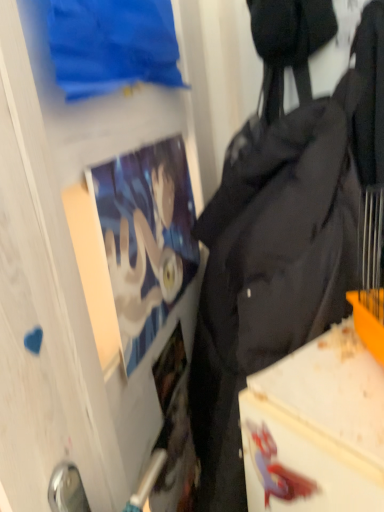
Where is `matte paper poster at upper left`? The image size is (384, 512). matte paper poster at upper left is located at coordinates (146, 238).

Find the location of a particular element. black fabric backpack at right is located at coordinates (281, 226).

Is transparent glass door at upper center bigger than black fabric backpack at right?

No, transparent glass door at upper center is not bigger than black fabric backpack at right.

Considering the points (12, 177) and (235, 346), which point is behind, point (12, 177) or point (235, 346)?

The point (235, 346) is farther from the camera.

How distant is transparent glass door at upper center from black fabric backpack at right?

A distance of 11.99 inches exists between transparent glass door at upper center and black fabric backpack at right.

Considering the relative positions of black fabric backpack at right and matte paper poster at upper left in the image provided, is black fabric backpack at right to the right of matte paper poster at upper left from the viewer's perspective?

Yes.

Between black fabric backpack at right and matte paper poster at upper left, which one has more height?

black fabric backpack at right is taller.

From a real-world perspective, between black fabric backpack at right and matte paper poster at upper left, who is vertically higher?

In real-world perspective, matte paper poster at upper left is above.

How distant is transparent glass door at upper center from matte paper poster at upper left?

They are 8.63 inches apart.

From a real-world perspective, is transparent glass door at upper center located beneath matte paper poster at upper left?

Correct, in the physical world, transparent glass door at upper center is lower than matte paper poster at upper left.

Considering the relative sizes of transparent glass door at upper center and matte paper poster at upper left in the image provided, is transparent glass door at upper center wider than matte paper poster at upper left?

Yes.

From the image's perspective, is transparent glass door at upper center located above or below matte paper poster at upper left?

transparent glass door at upper center is situated lower than matte paper poster at upper left in the image.

Is black fabric backpack at right in front of or behind transparent glass door at upper center in the image?

In the image, black fabric backpack at right appears behind transparent glass door at upper center.

Considering the sizes of objects black fabric backpack at right and transparent glass door at upper center in the image provided, who is thinner, black fabric backpack at right or transparent glass door at upper center?

Thinner between the two is transparent glass door at upper center.

From the image's perspective, is black fabric backpack at right on transparent glass door at upper center?

No, from the image's perspective, black fabric backpack at right is not on top of transparent glass door at upper center.

From their relative heights in the image, would you say black fabric backpack at right is taller or shorter than transparent glass door at upper center?

In the image, black fabric backpack at right appears to be taller than transparent glass door at upper center.

Considering the relative sizes of matte paper poster at upper left and black fabric backpack at right in the image provided, is matte paper poster at upper left smaller than black fabric backpack at right?

Yes, matte paper poster at upper left is smaller than black fabric backpack at right.

Is matte paper poster at upper left directly adjacent to black fabric backpack at right?

No, matte paper poster at upper left is not beside black fabric backpack at right.

From the image's perspective, between matte paper poster at upper left and black fabric backpack at right, which one is located above?

From the image's view, matte paper poster at upper left is above.

Is matte paper poster at upper left in front of or behind transparent glass door at upper center in the image?

matte paper poster at upper left is positioned farther from the viewer than transparent glass door at upper center.

Could you tell me if matte paper poster at upper left is facing transparent glass door at upper center?

Yes, matte paper poster at upper left is oriented towards transparent glass door at upper center.

Considering the sizes of matte paper poster at upper left and transparent glass door at upper center in the image, is matte paper poster at upper left wider or thinner than transparent glass door at upper center?

Clearly, matte paper poster at upper left has less width compared to transparent glass door at upper center.

Is point (153, 242) positioned before point (37, 178)?

No.

The image size is (384, 512). In order to click on backpack on the right of transparent glass door at upper center in this screenshot , I will do `click(281, 226)`.

At what (x,y) coordinates should I click in order to perform the action: click on person above the black fabric backpack at right (from a real-world perspective). Please return your answer as a coordinate pair (x, y). Image resolution: width=384 pixels, height=512 pixels. Looking at the image, I should click on (146, 238).

Considering their positions, is transparent glass door at upper center positioned closer to matte paper poster at upper left than black fabric backpack at right?

black fabric backpack at right is positioned closer to the anchor matte paper poster at upper left.

Considering their positions, is matte paper poster at upper left positioned further to transparent glass door at upper center than black fabric backpack at right?

Based on the image, black fabric backpack at right appears to be further to transparent glass door at upper center.

Estimate the real-world distances between objects in this image. Which object is further from transparent glass door at upper center, black fabric backpack at right or matte paper poster at upper left?

black fabric backpack at right.

Estimate the real-world distances between objects in this image. Which object is further from black fabric backpack at right, matte paper poster at upper left or transparent glass door at upper center?

Among the two, transparent glass door at upper center is located further to black fabric backpack at right.

Which object lies nearer to the anchor point black fabric backpack at right, transparent glass door at upper center or matte paper poster at upper left?

matte paper poster at upper left is closer to black fabric backpack at right.

Considering their positions, is black fabric backpack at right positioned closer to matte paper poster at upper left than transparent glass door at upper center?

black fabric backpack at right.

Identify the location of backpack positioned between transparent glass door at upper center and matte paper poster at upper left from near to far. Image resolution: width=384 pixels, height=512 pixels. (281, 226).